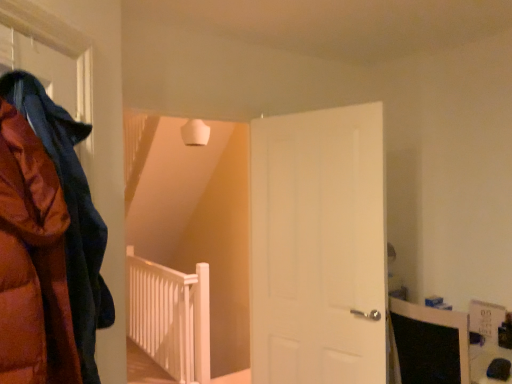
This screenshot has height=384, width=512. What do you see at coordinates (318, 247) in the screenshot?
I see `white matte door at center` at bounding box center [318, 247].

What do you see at coordinates (170, 317) in the screenshot? The image size is (512, 384). I see `white wooden rail at center` at bounding box center [170, 317].

The height and width of the screenshot is (384, 512). Find the location of `matte orange puffer jacket at left`. matte orange puffer jacket at left is located at coordinates (72, 211).

Could you tell me if white matte door at center is facing matte orange puffer jacket at left?

Yes, white matte door at center is aimed at matte orange puffer jacket at left.

Identify the location of door that is below the matte orange puffer jacket at left (from the image's perspective). (318, 247).

Is there a large distance between white matte door at center and matte orange puffer jacket at left?

Yes, white matte door at center and matte orange puffer jacket at left are quite far apart.

Is white matte door at center wider or thinner than matte orange puffer jacket at left?

Considering their sizes, white matte door at center looks slimmer than matte orange puffer jacket at left.

Does matte orange puffer jacket at left have a lesser width compared to white matte door at center?

Incorrect, the width of matte orange puffer jacket at left is not less than that of white matte door at center.

Consider the image. Is matte orange puffer jacket at left positioned with its back to white matte door at center?

No, matte orange puffer jacket at left's orientation is not away from white matte door at center.

Is matte orange puffer jacket at left smaller than white matte door at center?

Correct, matte orange puffer jacket at left occupies less space than white matte door at center.

From the image's perspective, relative to white matte door at center, is matte orange puffer jacket at left above or below?

From the image's perspective, matte orange puffer jacket at left appears above white matte door at center.

Is white wooden rail at center closer to the viewer compared to matte orange puffer jacket at left?

No, the depth of white wooden rail at center is greater than that of matte orange puffer jacket at left.

Is white wooden rail at center taller or shorter than matte orange puffer jacket at left?

Clearly, white wooden rail at center is taller compared to matte orange puffer jacket at left.

Is white wooden rail at center looking in the opposite direction of matte orange puffer jacket at left?

No, white wooden rail at center is not facing the opposite direction of matte orange puffer jacket at left.

Does white wooden rail at center turn towards white matte door at center?

No, white wooden rail at center does not turn towards white matte door at center.

Which of these two, white wooden rail at center or white matte door at center, stands taller?

white matte door at center.

Are white wooden rail at center and white matte door at center far apart?

white wooden rail at center is far away from white matte door at center.

From the image's perspective, is white wooden rail at center positioned above or below white matte door at center?

From the image's perspective, white wooden rail at center appears below white matte door at center.

From the image's perspective, is white matte door at center above or below white wooden rail at center?

white matte door at center is situated higher than white wooden rail at center in the image.

In the scene shown: From a real-world perspective, is white matte door at center over white wooden rail at center?

Yes, from a real-world perspective, white matte door at center is over white wooden rail at center

Between white matte door at center and white wooden rail at center, which one has more height?

white matte door at center is taller.

In the scene shown: Is matte orange puffer jacket at left with white wooden rail at center?

No, matte orange puffer jacket at left is not next to white wooden rail at center.

Is matte orange puffer jacket at left facing towards white wooden rail at center?

No, matte orange puffer jacket at left does not turn towards white wooden rail at center.

From a real-world perspective, is matte orange puffer jacket at left physically located above or below white wooden rail at center?

matte orange puffer jacket at left is above white wooden rail at center.

Is matte orange puffer jacket at left located outside white wooden rail at center?

Yes, matte orange puffer jacket at left is outside of white wooden rail at center.

Image resolution: width=512 pixels, height=384 pixels. Find the location of `cloak above the white matte door at center (from a real-world perspective)`. cloak above the white matte door at center (from a real-world perspective) is located at coordinates (72, 211).

Locate an element on the screen. cloak in front of the white matte door at center is located at coordinates (72, 211).

Estimate the real-world distances between objects in this image. Which object is further from white wooden rail at center, matte orange puffer jacket at left or white matte door at center?

matte orange puffer jacket at left lies further to white wooden rail at center than the other object.

From the image, which object appears to be farther from white wooden rail at center, white matte door at center or matte orange puffer jacket at left?

The object further to white wooden rail at center is matte orange puffer jacket at left.

Looking at the image, which one is located further to white matte door at center, white wooden rail at center or matte orange puffer jacket at left?

white wooden rail at center is positioned further to the anchor white matte door at center.

Based on their spatial positions, is matte orange puffer jacket at left or white wooden rail at center closer to white matte door at center?

matte orange puffer jacket at left is closer to white matte door at center.

Based on their spatial positions, is white matte door at center or white wooden rail at center further from matte orange puffer jacket at left?

white wooden rail at center is positioned further to the anchor matte orange puffer jacket at left.

Estimate the real-world distances between objects in this image. Which object is further from matte orange puffer jacket at left, white wooden rail at center or white matte door at center?

The object further to matte orange puffer jacket at left is white wooden rail at center.

Locate an element on the screen. The height and width of the screenshot is (384, 512). door between matte orange puffer jacket at left and white wooden rail at center from front to back is located at coordinates (318, 247).